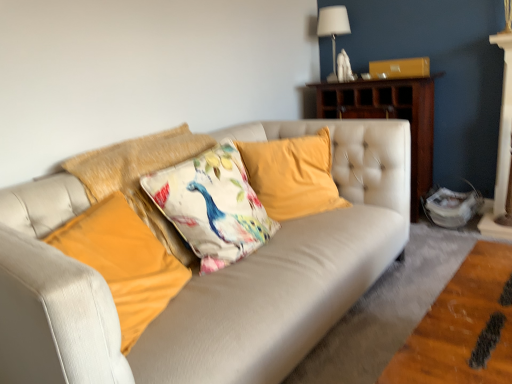
Question: Is floral fabric cushion at center, which is the 2th pillow from right to left, positioned beyond the bounds of velvet yellow pillow at center, which is the fourth pillow from left to right?

Choices:
 (A) yes
 (B) no

Answer: (A)

Question: From the image's perspective, is floral fabric cushion at center, the 3th pillow viewed from the left, above velvet yellow pillow at center, which is the fourth pillow from left to right?

Choices:
 (A) yes
 (B) no

Answer: (B)

Question: Is the position of floral fabric cushion at center, which is the 2th pillow from right to left, more distant than that of velvet yellow pillow at center, arranged as the first pillow when viewed from the right?

Choices:
 (A) yes
 (B) no

Answer: (B)

Question: Is floral fabric cushion at center, the 3th pillow viewed from the left, oriented towards velvet yellow pillow at center, arranged as the first pillow when viewed from the right?

Choices:
 (A) no
 (B) yes

Answer: (A)

Question: Considering the relative sizes of floral fabric cushion at center, which is the 2th pillow from right to left, and velvet yellow pillow at center, which is the fourth pillow from left to right, in the image provided, is floral fabric cushion at center, which is the 2th pillow from right to left, wider than velvet yellow pillow at center, which is the fourth pillow from left to right,?

Choices:
 (A) no
 (B) yes

Answer: (B)

Question: Choose the correct answer: Is velvet yellow pillow at center, which is the fourth pillow from left to right, inside floral fabric cushion at center, the 3th pillow viewed from the left, or outside it?

Choices:
 (A) inside
 (B) outside

Answer: (B)

Question: In the image, is velvet yellow pillow at center, arranged as the first pillow when viewed from the right, positioned in front of or behind floral fabric cushion at center, the 3th pillow viewed from the left?

Choices:
 (A) front
 (B) behind

Answer: (B)

Question: Is velvet yellow pillow at center, which is the fourth pillow from left to right, taller or shorter than floral fabric cushion at center, the 3th pillow viewed from the left?

Choices:
 (A) short
 (B) tall

Answer: (B)

Question: Considering the relative positions of velvet yellow pillow at center, which is the fourth pillow from left to right, and floral fabric cushion at center, the 3th pillow viewed from the left, in the image provided, is velvet yellow pillow at center, which is the fourth pillow from left to right, to the left or to the right of floral fabric cushion at center, the 3th pillow viewed from the left,?

Choices:
 (A) left
 (B) right

Answer: (B)

Question: Considering the positions of floral fabric cushion at center, placed as the 2th pillow when sorted from left to right, and white fabric lampshade at upper right in the image, is floral fabric cushion at center, placed as the 2th pillow when sorted from left to right, taller or shorter than white fabric lampshade at upper right?

Choices:
 (A) tall
 (B) short

Answer: (B)

Question: Is floral fabric cushion at center, placed as the 2th pillow when sorted from left to right, bigger or smaller than white fabric lampshade at upper right?

Choices:
 (A) big
 (B) small

Answer: (A)

Question: From the image's perspective, relative to white fabric lampshade at upper right, is floral fabric cushion at center, marked as the third pillow in a right-to-left arrangement, above or below?

Choices:
 (A) below
 (B) above

Answer: (A)

Question: Considering the relative positions of floral fabric cushion at center, placed as the 2th pillow when sorted from left to right, and white fabric lampshade at upper right in the image provided, is floral fabric cushion at center, placed as the 2th pillow when sorted from left to right, to the left or to the right of white fabric lampshade at upper right?

Choices:
 (A) left
 (B) right

Answer: (A)

Question: From a real-world perspective, is velvet yellow pillow at center, which is the fourth pillow from left to right, physically located above or below velvet orange pillow at center, which ranks as the 4th pillow in right-to-left order?

Choices:
 (A) below
 (B) above

Answer: (B)

Question: From the image's perspective, relative to velvet orange pillow at center, the 1th pillow positioned from the left, is velvet yellow pillow at center, which is the fourth pillow from left to right, above or below?

Choices:
 (A) below
 (B) above

Answer: (B)